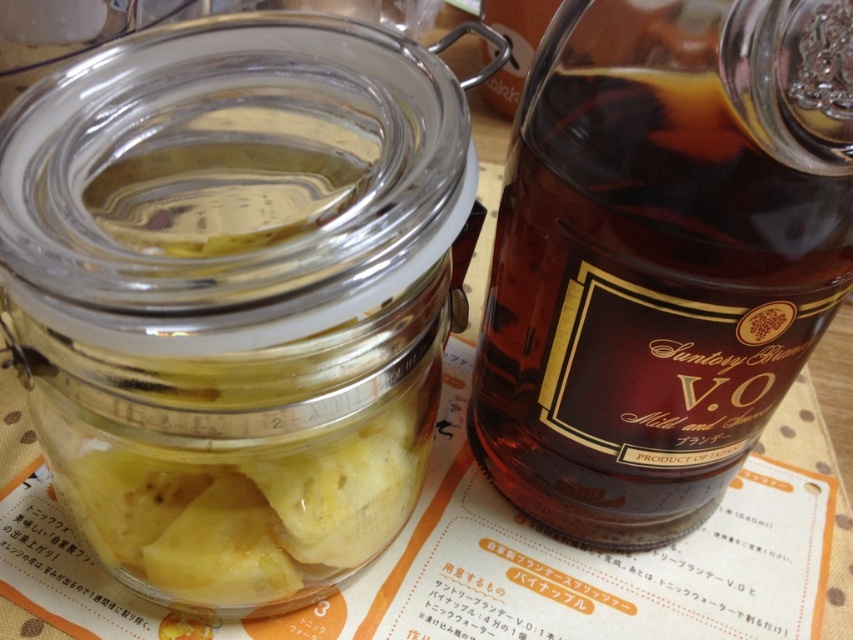
Question: From the image, what is the correct spatial relationship of transparent glass jar at left in relation to brown glass bottle at right?

Choices:
 (A) left
 (B) right

Answer: (A)

Question: Which point is farther to the camera?

Choices:
 (A) (390, 474)
 (B) (737, 115)

Answer: (A)

Question: Can you confirm if transparent glass jar at left is wider than brown glass bottle at right?

Choices:
 (A) no
 (B) yes

Answer: (B)

Question: Does transparent glass jar at left have a larger size compared to brown glass bottle at right?

Choices:
 (A) yes
 (B) no

Answer: (A)